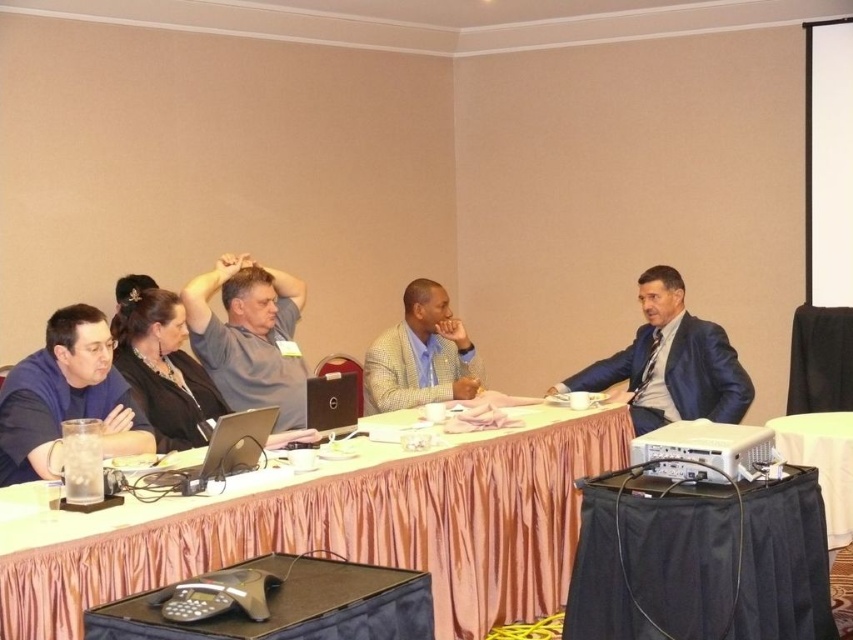
From the picture: Does matte black shirt at left appear on the left side of silver metallic laptop at center?

Correct, you'll find matte black shirt at left to the left of silver metallic laptop at center.

Is matte black shirt at left further to camera compared to silver metallic laptop at center?

Yes, matte black shirt at left is behind silver metallic laptop at center.

Locate an element on the screen. The width and height of the screenshot is (853, 640). matte black shirt at left is located at coordinates (67, 397).

Between black fabric projector at lower right and matte black speaker at center, which one is positioned lower?

black fabric projector at lower right

Which of these two, black fabric projector at lower right or matte black speaker at center, stands taller?

black fabric projector at lower right is taller.

Between point (753, 579) and point (347, 387), which one is positioned behind?

The point (347, 387) is more distant.

Where is `black fabric projector at lower right`? The image size is (853, 640). black fabric projector at lower right is located at coordinates (699, 560).

In the scene shown: Does black fabric projector at lower right come in front of silver metallic laptop at center?

Yes, it is.

Who is positioned more to the left, black fabric projector at lower right or silver metallic laptop at center?

silver metallic laptop at center

Locate an element on the screen. black fabric projector at lower right is located at coordinates (699, 560).

Find the location of `black fabric projector at lower right`. black fabric projector at lower right is located at coordinates (699, 560).